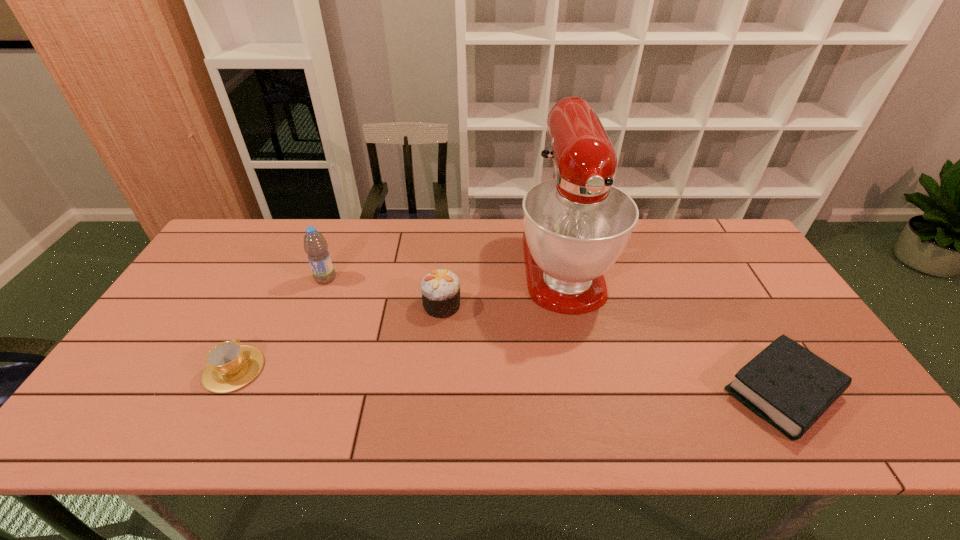
Find the location of `free space that satisfies the following two spatial constraints: 1. with the handle on the side of the cupcake; 2. on the left side of the cup`. free space that satisfies the following two spatial constraints: 1. with the handle on the side of the cupcake; 2. on the left side of the cup is located at coordinates (266, 305).